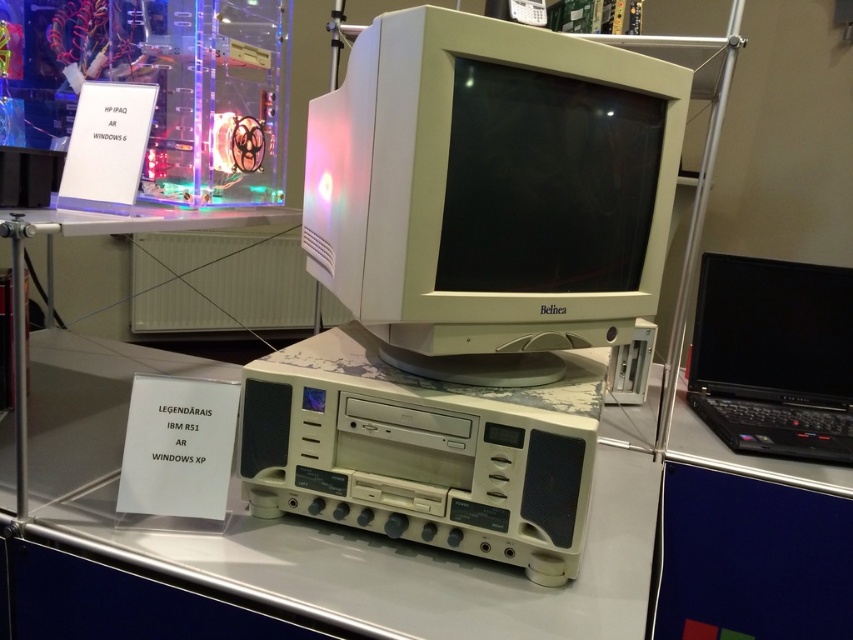
Which is behind, point (93, 342) or point (746, 328)?

The point (93, 342) is behind.

Does white plastic table at center have a lesser height compared to black plastic laptop at right?

Correct, white plastic table at center is not as tall as black plastic laptop at right.

Does point (618, 417) lie behind point (721, 435)?

Yes, it is behind point (721, 435).

Locate an element on the screen. white plastic table at center is located at coordinates (323, 525).

Does white plastic monitor at center appear on the left side of white plastic table at center?

No, white plastic monitor at center is not to the left of white plastic table at center.

Can you confirm if white plastic monitor at center is thinner than white plastic table at center?

Indeed, white plastic monitor at center has a lesser width compared to white plastic table at center.

Which is behind, point (595, 163) or point (596, 552)?

The point (596, 552) is more distant.

At what (x,y) coordinates should I click in order to perform the action: click on white plastic monitor at center. Please return your answer as a coordinate pair (x, y). Looking at the image, I should click on (491, 193).

Can you confirm if white plastic monitor at center is positioned to the left of black plastic laptop at right?

Correct, you'll find white plastic monitor at center to the left of black plastic laptop at right.

Does white plastic monitor at center have a lesser width compared to black plastic laptop at right?

No.

Who is more distant from viewer, (x=564, y=257) or (x=740, y=348)?

Positioned behind is point (x=740, y=348).

Where is `white plastic monitor at center`? The image size is (853, 640). white plastic monitor at center is located at coordinates (491, 193).